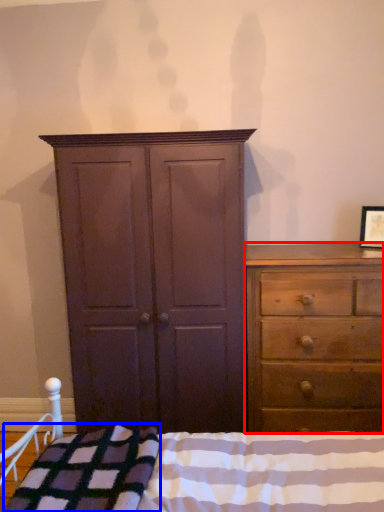
Question: Which point is further to the camera, chest of drawers (highlighted by a red box) or blanket (highlighted by a blue box)?

Choices:
 (A) chest of drawers
 (B) blanket

Answer: (A)